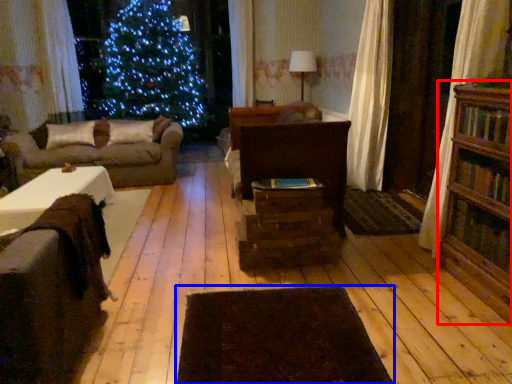
Question: Which point is closer to the camera, bookcase (highlighted by a red box) or wide (highlighted by a blue box)?

Choices:
 (A) bookcase
 (B) wide

Answer: (B)